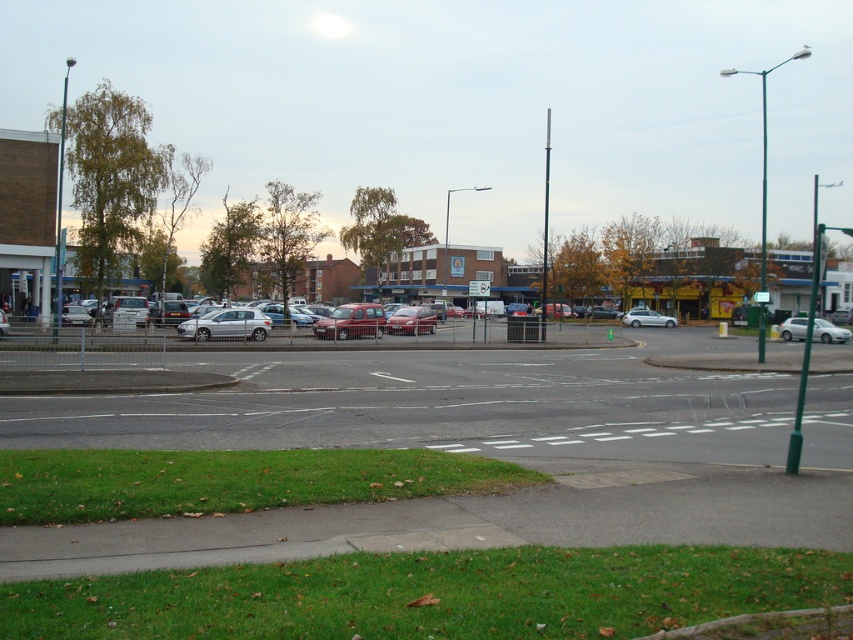
Question: Estimate the real-world distances between objects in this image. Which object is farther from the satin silver hatchback at center?

Choices:
 (A) silver metallic sedan at center
 (B) metallic red van at center
 (C) white matte car at right
 (D) metallic silver car at center

Answer: (A)

Question: Is metallic red van at center wider than silver metallic sedan at center?

Choices:
 (A) yes
 (B) no

Answer: (A)

Question: Considering the real-world distances, which object is farthest from the white matte car at right?

Choices:
 (A) silver metallic sedan at center
 (B) metallic red van at center

Answer: (B)

Question: Which of these objects is positioned farthest from the silver metallic sedan at center?

Choices:
 (A) satin silver hatchback at center
 (B) metallic silver car at center
 (C) metallic red van at center
 (D) white matte car at right

Answer: (A)

Question: In this image, where is satin silver hatchback at center located relative to metallic silver car at center?

Choices:
 (A) right
 (B) left

Answer: (B)

Question: Does satin silver hatchback at center come in front of white matte car at right?

Choices:
 (A) yes
 (B) no

Answer: (A)